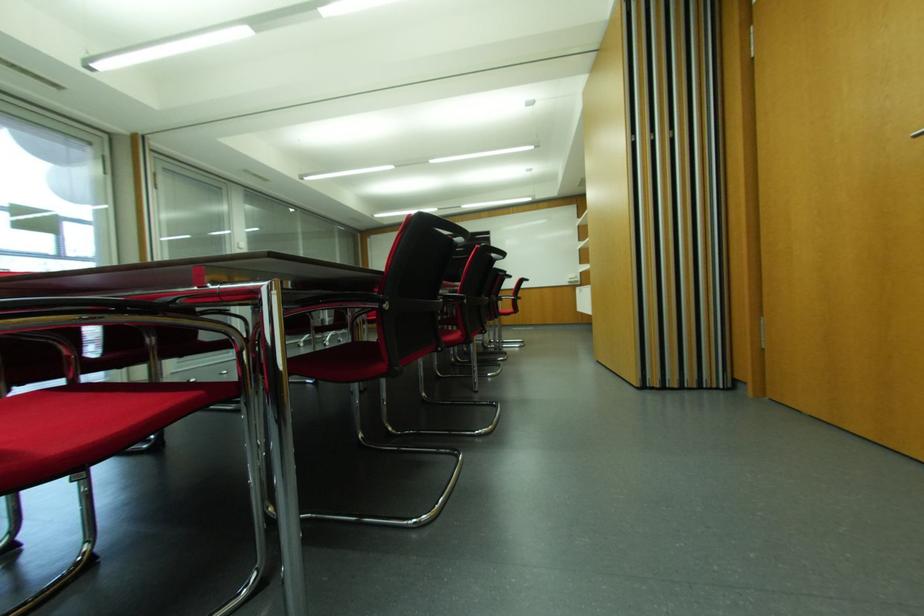
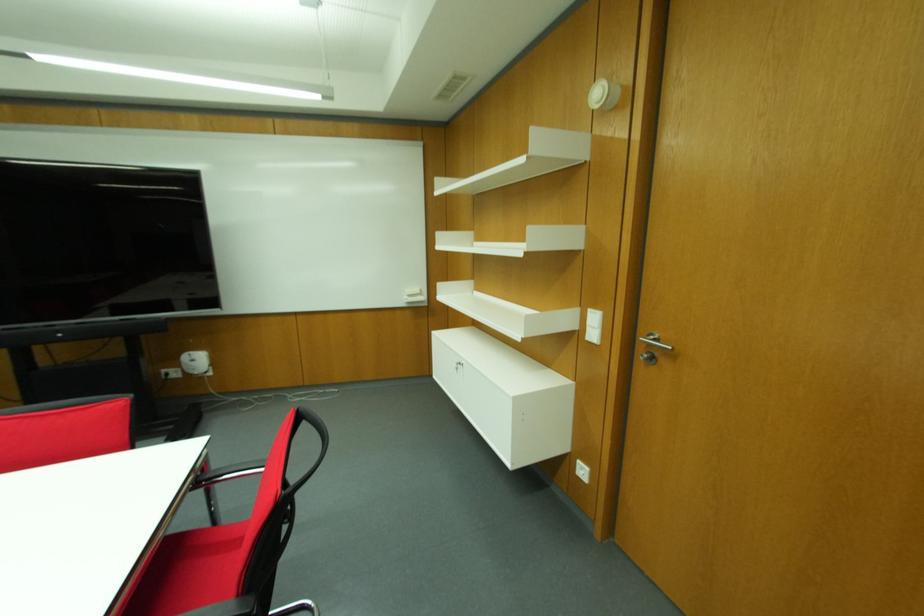
Where in the second image is the point corresponding to [573,275] from the first image?

(416, 291)